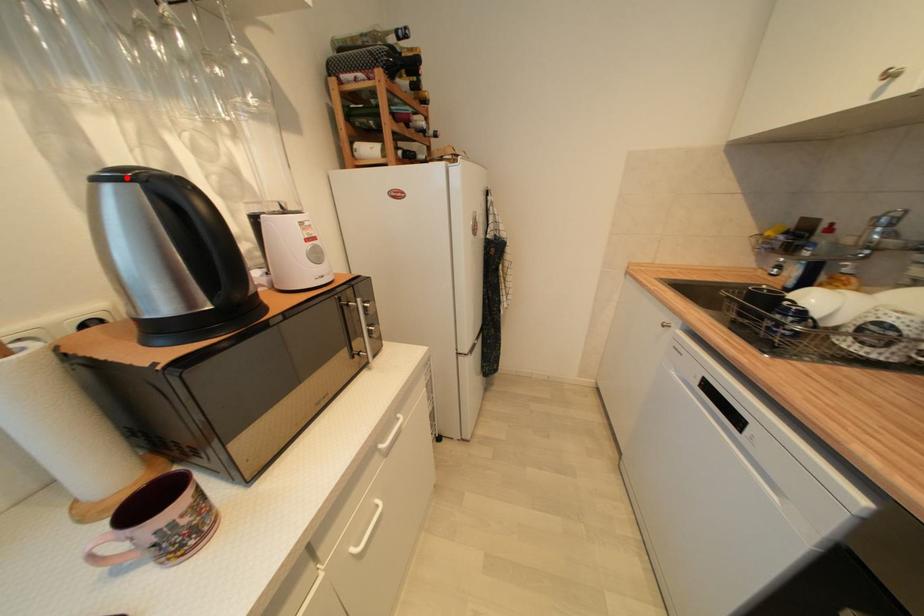
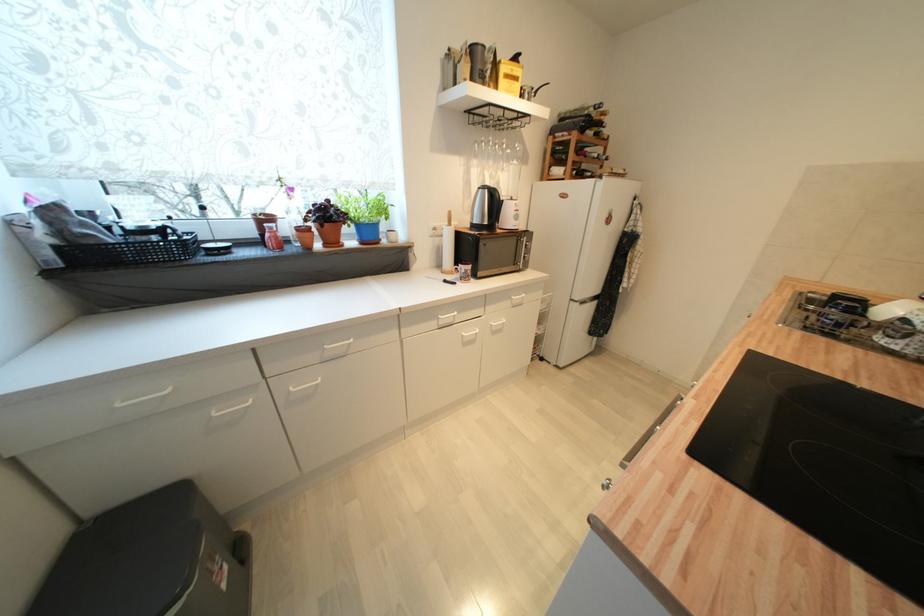
Question: I am providing you with two images of the same scene from different viewpoints. Image1 has a red point marked. In image2, the corresponding 3D location appears at what relative position? Reply with the corresponding letter.

Choices:
 (A) Closer
 (B) Farther

Answer: (A)